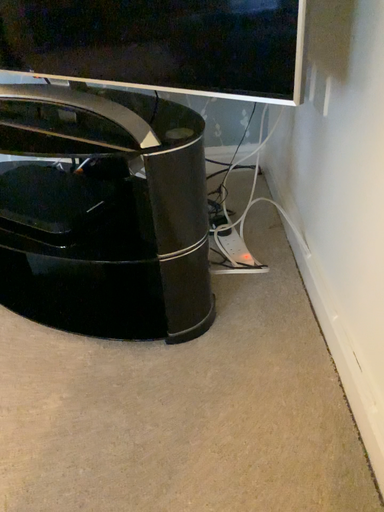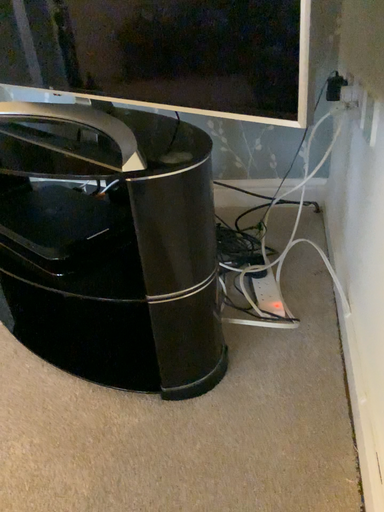
Question: Which way did the camera rotate in the video?

Choices:
 (A) rotated right
 (B) rotated left

Answer: (B)